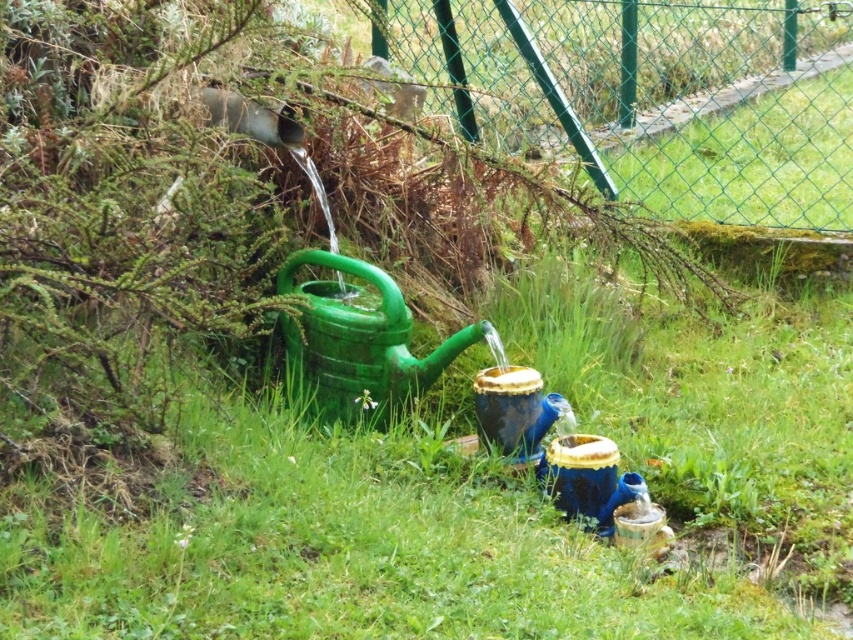
You are standing at the origin point of the coordinate system, which is the bottom left corner of the image. The green plastic watering can at center is at point (357, 342). If you want to walk directly to the green plastic watering can at center, which direction should you move in terms of x and y coordinates?

To reach the green plastic watering can at center located at point (357, 342) from the origin at the bottom left corner, you should move in the positive x and positive y directions since both coordinates are greater than zero.

You are standing in the garden and see the green plastic watering can at center and the blue glossy water at lower center. Which object is closer to the left side of the garden?

The green plastic watering can at center is to the left of blue glossy water at lower center, so it is closer to the left side of the garden.